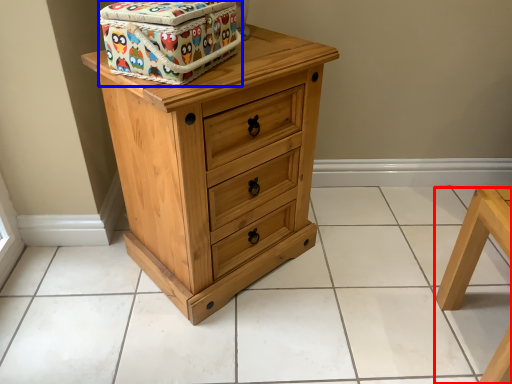
Question: Which of the following is the closest to the observer, furniture (highlighted by a red box) or cardboard box (highlighted by a blue box)?

Choices:
 (A) furniture
 (B) cardboard box

Answer: (B)